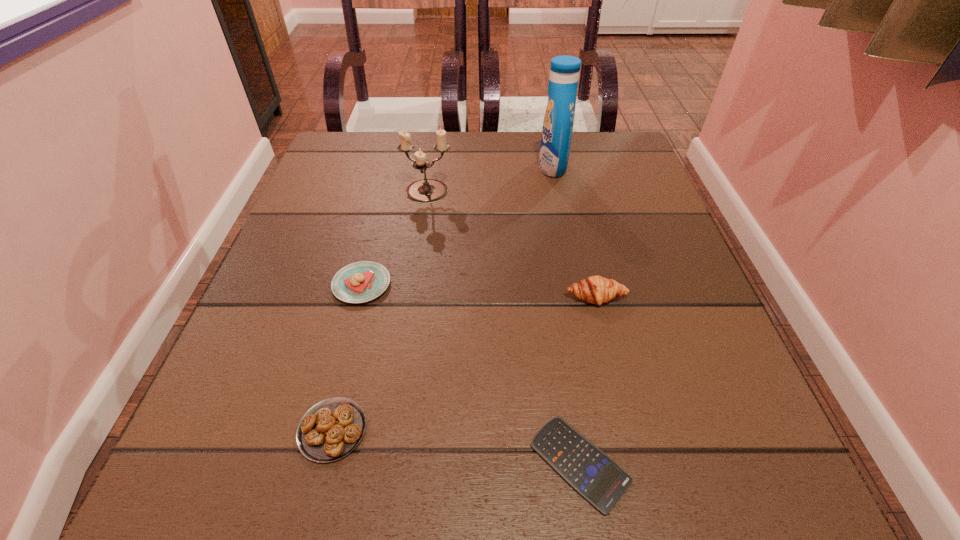
Point out which pastry is positioned as the third nearest to the detergent. Please provide its 2D coordinates. Your answer should be formatted as a tuple, i.e. [(x, y)], where the tuple contains the x and y coordinates of a point satisfying the conditions above.

[(331, 429)]

This screenshot has width=960, height=540. I want to click on pastry that is the second closest one to the shortest object, so click(331, 429).

The height and width of the screenshot is (540, 960). In order to click on free spot that satisfies the following two spatial constraints: 1. on the back side of the candle holder; 2. on the left side of the second tallest pastry in this screenshot , I will do `click(385, 193)`.

Identify the location of vacant space that satisfies the following two spatial constraints: 1. on the front side of the shortest pastry; 2. on the right side of the fourth tallest object. (324, 430).

Locate an element on the screen. The width and height of the screenshot is (960, 540). free point that satisfies the following two spatial constraints: 1. on the back side of the second shortest object; 2. on the right side of the candle holder is located at coordinates (390, 193).